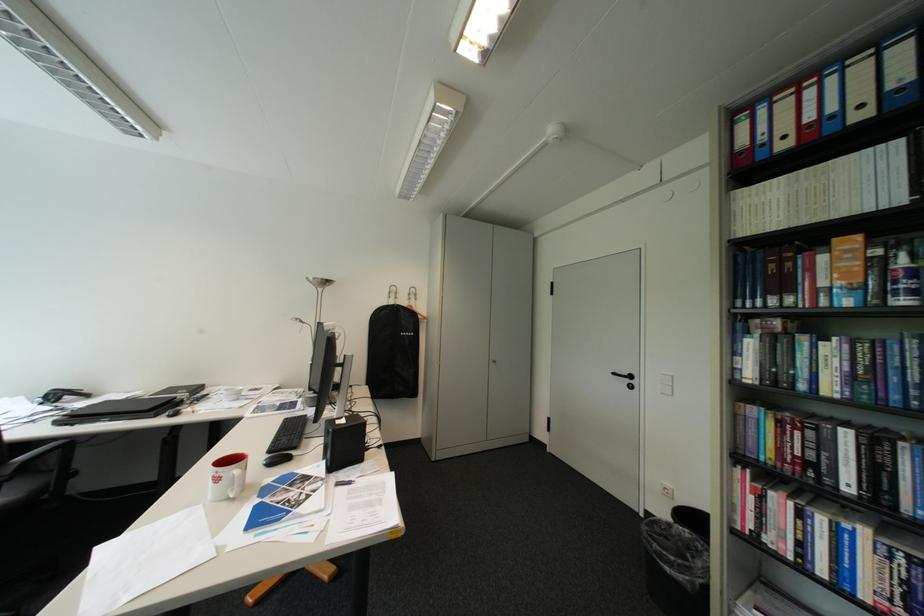
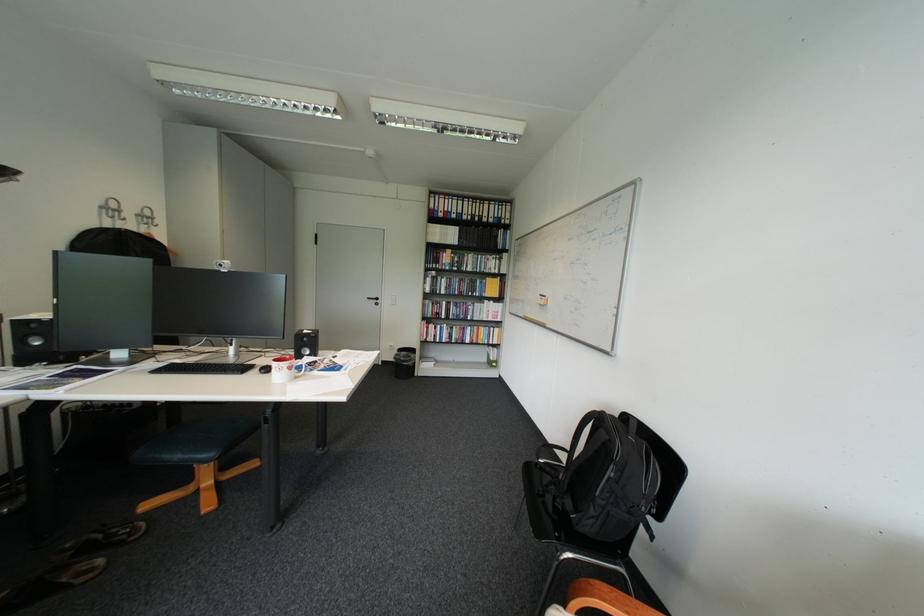
Find the pixel in the second image that matches (659,513) in the first image.

(395, 362)